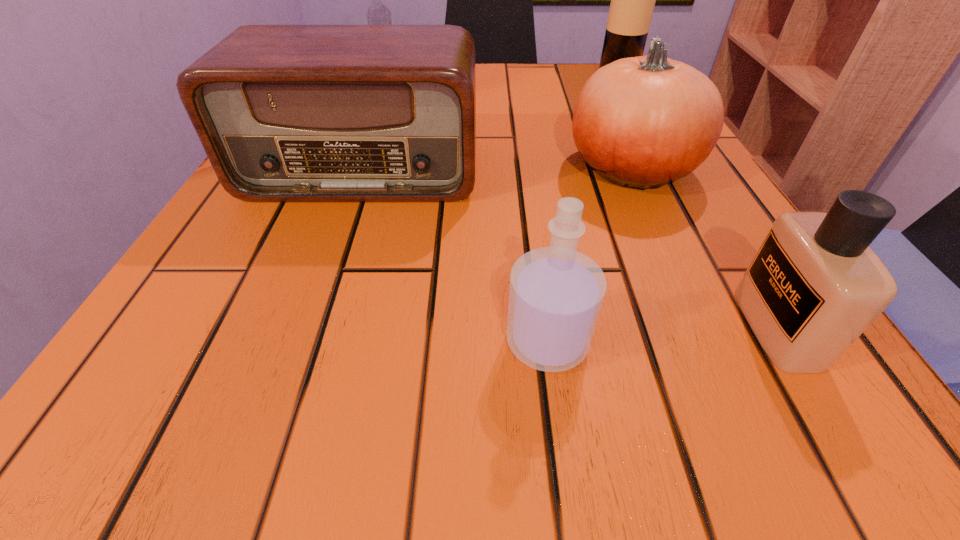
Find the location of a particular element. This screenshot has width=960, height=540. perfume positioned at the right edge is located at coordinates tap(814, 286).

Locate an element on the screen. Image resolution: width=960 pixels, height=540 pixels. object that is at the far left corner is located at coordinates (377, 14).

Find the location of `object present at the far right corner`. object present at the far right corner is located at coordinates (632, 4).

You are a GUI agent. You are given a task and a screenshot of the screen. Output one action in this format:
    pyautogui.click(x=<x>, y=<y>)
    Task: Click on the free space at the near edge
    The height and width of the screenshot is (540, 960).
    Given the screenshot: What is the action you would take?
    pyautogui.click(x=413, y=406)

You are a GUI agent. You are given a task and a screenshot of the screen. Output one action in this format:
    pyautogui.click(x=<x>, y=<y>)
    Task: Click on the vacant space at the left edge of the desktop
    This screenshot has width=960, height=540.
    Given the screenshot: What is the action you would take?
    [214, 341]

The image size is (960, 540). In the image, there is a desktop. Identify the location of vacant area at the right edge. (834, 372).

The height and width of the screenshot is (540, 960). In the image, there is a desktop. Find the location of `vacant space at the near right corner`. vacant space at the near right corner is located at coordinates (750, 450).

Locate an element on the screen. Image resolution: width=960 pixels, height=540 pixels. vacant area that lies between the fourth object from right to left and the pumpkin is located at coordinates (589, 255).

Locate an element on the screen. free spot between the right perfume and the wine bottle is located at coordinates (697, 201).

The width and height of the screenshot is (960, 540). I want to click on free space between the pumpkin and the third object from left to right, so click(589, 255).